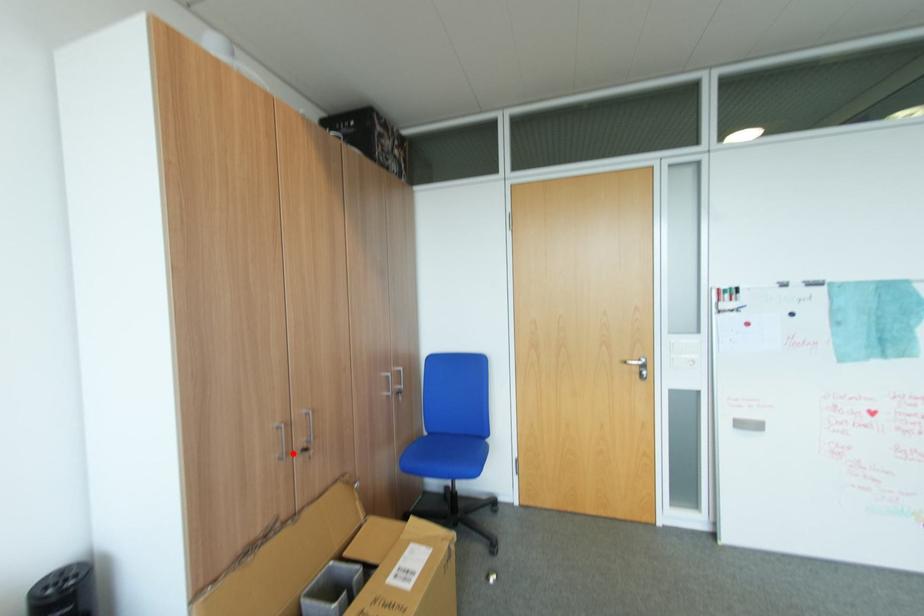
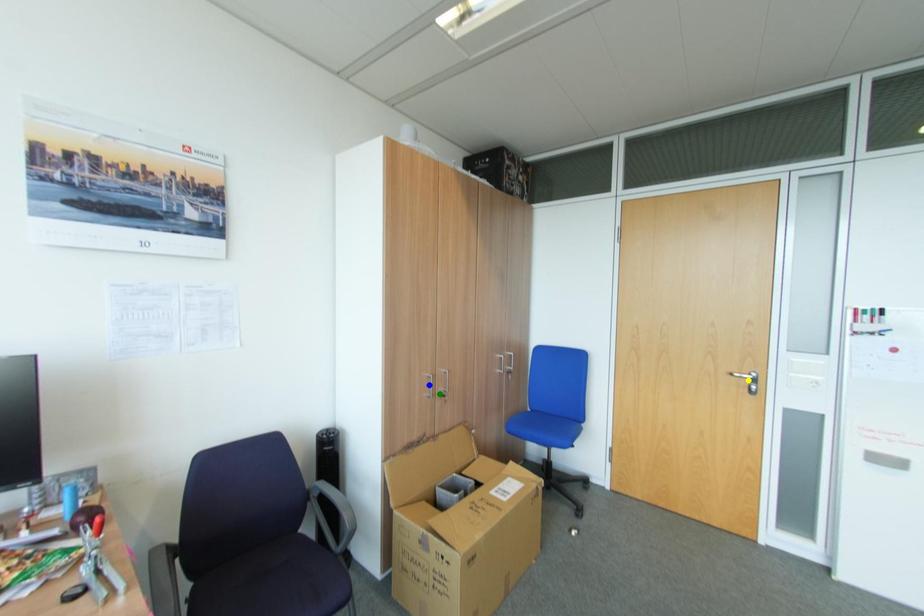
Question: I am providing you with two images of the same scene from different viewpoints. A red point is marked on the first image. You are given multiple points on the second image. Which spot in image 2 lines up with the point in image 1?

Choices:
 (A) yellow point
 (B) green point
 (C) blue point

Answer: (B)